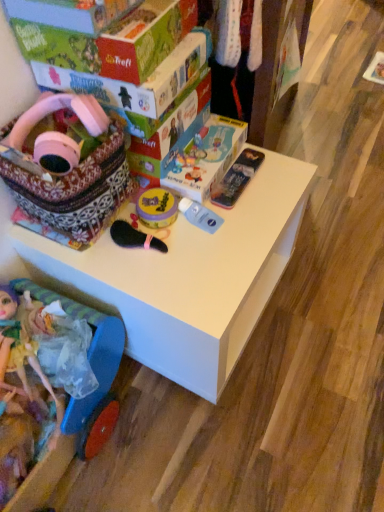
Where is `unoccupied region to the right of yellow matte jar at center, the 4th toy positioned from the left`? The height and width of the screenshot is (512, 384). unoccupied region to the right of yellow matte jar at center, the 4th toy positioned from the left is located at coordinates (238, 218).